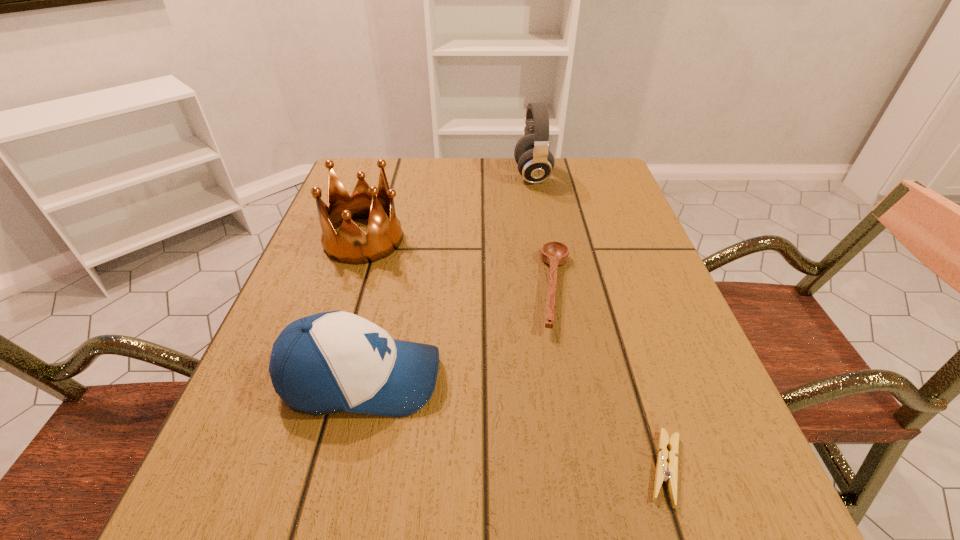
Identify the location of blank space that satisfies the following two spatial constraints: 1. on the ear cups of the farthest object; 2. on the right side of the nearest object. (585, 468).